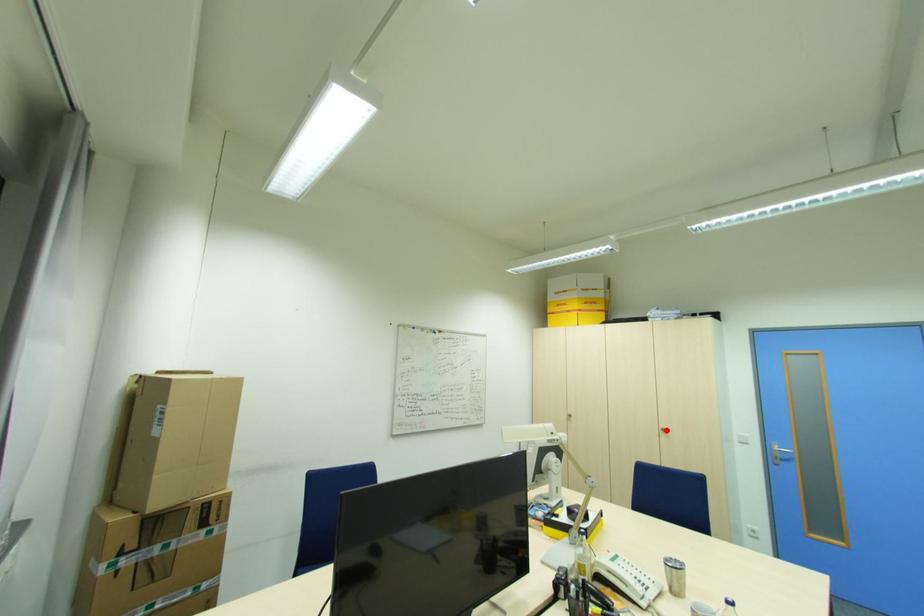
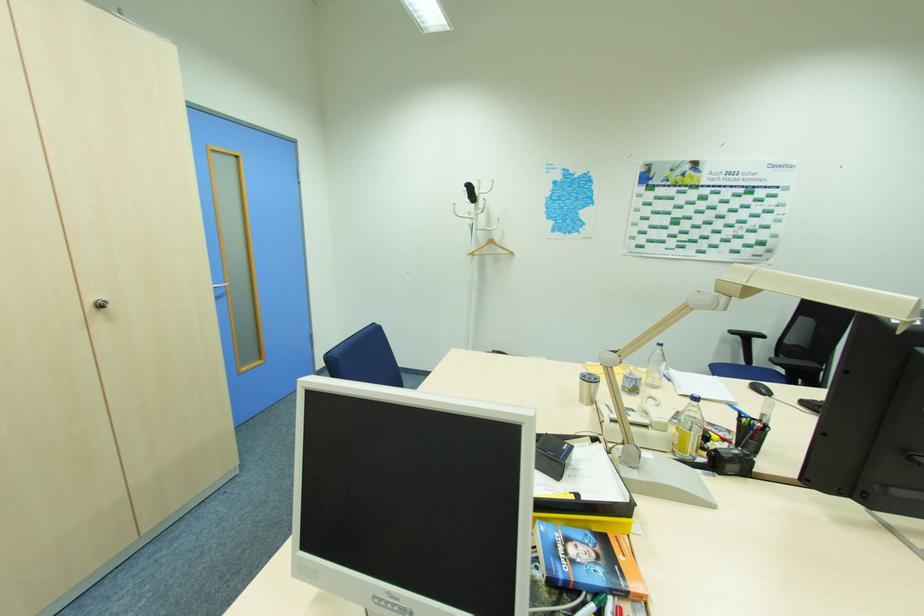
Question: I am providing you with two images of the same scene from different viewpoints. A red point is marked on the first image. At the location where the point appears in image 1, is it still visible in image 2?

Choices:
 (A) Yes
 (B) No

Answer: (A)